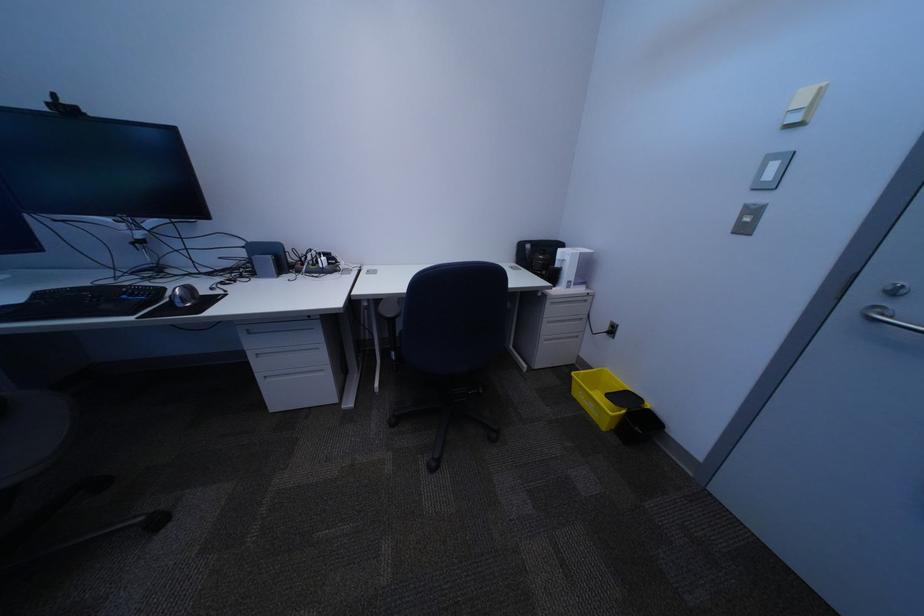
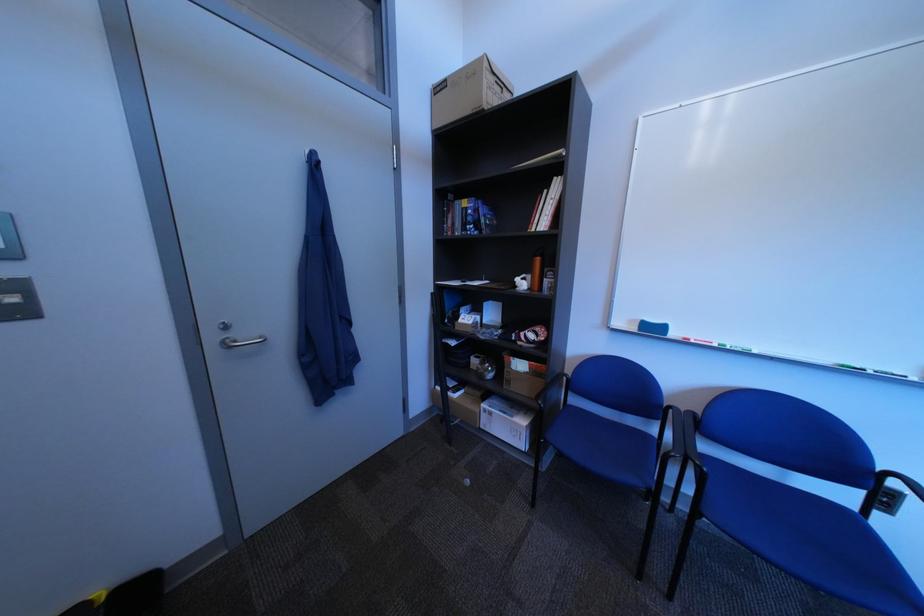
Find the pixel in the second image that matches the point at 877,299 in the first image.

(226, 339)